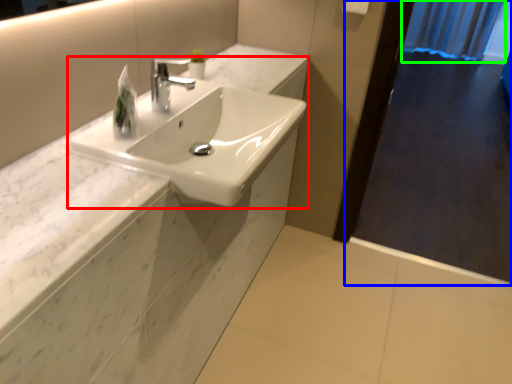
Question: Estimate the real-world distances between objects in this image. Which object is farther from sink (highlighted by a red box), screen door (highlighted by a blue box) or shower curtain (highlighted by a green box)?

Choices:
 (A) screen door
 (B) shower curtain

Answer: (B)